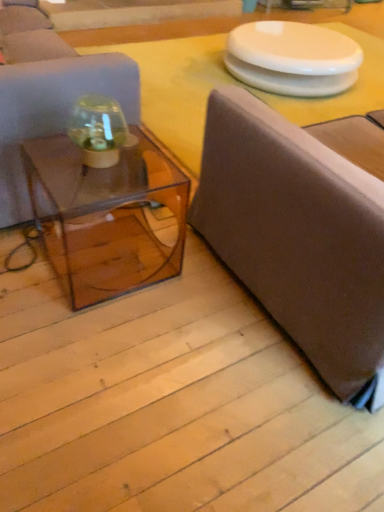
Question: From the image's perspective, is matte brown couch at left, the 2th studio couch viewed from the right, beneath transparent acrylic coffee table at center?

Choices:
 (A) no
 (B) yes

Answer: (A)

Question: Is matte brown couch at left, marked as the 1th studio couch in a left-to-right arrangement, at the left side of transparent acrylic coffee table at center?

Choices:
 (A) yes
 (B) no

Answer: (A)

Question: Is matte brown couch at left, the 2th studio couch viewed from the right, smaller than transparent acrylic coffee table at center?

Choices:
 (A) no
 (B) yes

Answer: (A)

Question: Does matte brown couch at left, marked as the 1th studio couch in a left-to-right arrangement, have a lesser height compared to transparent acrylic coffee table at center?

Choices:
 (A) yes
 (B) no

Answer: (B)

Question: Is matte brown couch at left, the 2th studio couch viewed from the right, located outside transparent acrylic coffee table at center?

Choices:
 (A) yes
 (B) no

Answer: (A)

Question: In terms of width, does transparent acrylic coffee table at center look wider or thinner when compared to matte brown couch at left, marked as the 1th studio couch in a left-to-right arrangement?

Choices:
 (A) wide
 (B) thin

Answer: (B)

Question: From the image's perspective, is transparent acrylic coffee table at center located above or below matte brown couch at left, the 2th studio couch viewed from the right?

Choices:
 (A) above
 (B) below

Answer: (B)

Question: Is point (172, 211) closer or farther from the camera than point (13, 169)?

Choices:
 (A) closer
 (B) farther

Answer: (B)

Question: From a real-world perspective, is transparent acrylic coffee table at center above or below matte brown couch at left, marked as the 1th studio couch in a left-to-right arrangement?

Choices:
 (A) below
 (B) above

Answer: (A)

Question: Does point (235, 38) appear closer or farther from the camera than point (91, 113)?

Choices:
 (A) closer
 (B) farther

Answer: (B)

Question: From the image's perspective, is white glossy round table at upper center located above or below transparent glass jar at center?

Choices:
 (A) above
 (B) below

Answer: (A)

Question: Considering the relative positions of white glossy round table at upper center and transparent glass jar at center in the image provided, is white glossy round table at upper center to the left or to the right of transparent glass jar at center?

Choices:
 (A) left
 (B) right

Answer: (B)

Question: Is white glossy round table at upper center wider or thinner than transparent glass jar at center?

Choices:
 (A) wide
 (B) thin

Answer: (A)

Question: Do you think transparent glass jar at center is within white glossy round table at upper center, or outside of it?

Choices:
 (A) outside
 (B) inside

Answer: (A)

Question: Does point (125, 125) appear closer or farther from the camera than point (312, 58)?

Choices:
 (A) closer
 (B) farther

Answer: (A)